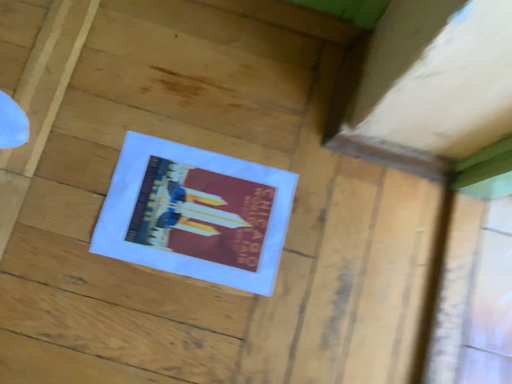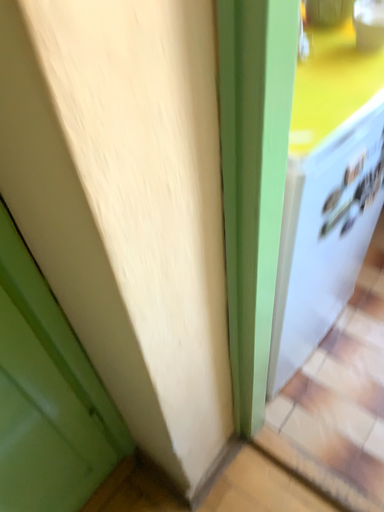
Question: How did the camera likely rotate when shooting the video?

Choices:
 (A) rotated upward
 (B) rotated downward

Answer: (A)